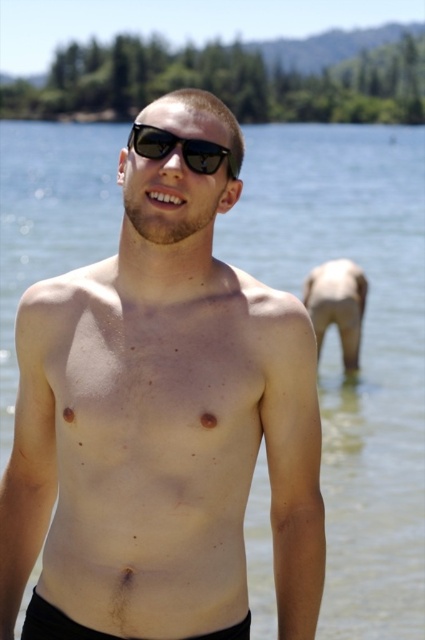
Between matte skin at center and black reflective sunglasses at center, which one appears on the left side from the viewer's perspective?

From the viewer's perspective, matte skin at center appears more on the left side.

Which is in front, point (215, 259) or point (173, 147)?

Positioned in front is point (173, 147).

What do you see at coordinates (161, 428) in the screenshot?
I see `matte skin at center` at bounding box center [161, 428].

Where is `matte skin at center`? matte skin at center is located at coordinates (161, 428).